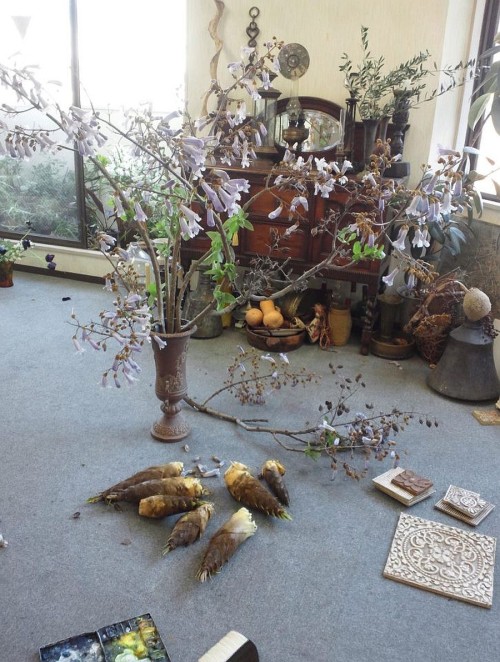
Where is `gray rug`? The image size is (500, 662). gray rug is located at coordinates (317, 604).